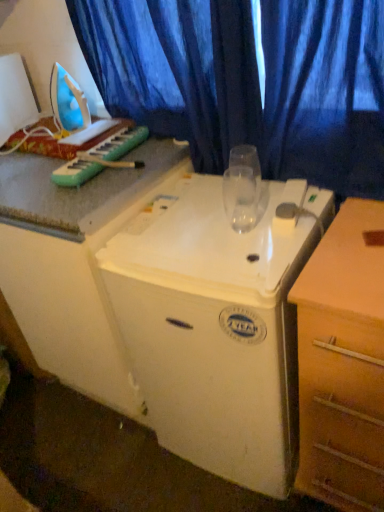
Question: Is white plastic iron at left, the first appliance positioned from the left, facing towards transparent glass at center?

Choices:
 (A) no
 (B) yes

Answer: (A)

Question: Considering the relative positions of white plastic iron at left, which appears as the 1th appliance when viewed from the top, and transparent glass at center in the image provided, is white plastic iron at left, which appears as the 1th appliance when viewed from the top, to the left of transparent glass at center from the viewer's perspective?

Choices:
 (A) no
 (B) yes

Answer: (B)

Question: Would you say white plastic iron at left, the first appliance positioned from the left, contains transparent glass at center?

Choices:
 (A) yes
 (B) no

Answer: (B)

Question: Would you consider white plastic iron at left, which is the second appliance in right-to-left order, to be distant from transparent glass at center?

Choices:
 (A) no
 (B) yes

Answer: (A)

Question: From the image's perspective, is white plastic iron at left, which appears as the 1th appliance when viewed from the top, above transparent glass at center?

Choices:
 (A) no
 (B) yes

Answer: (B)

Question: Looking at their shapes, would you say white plastic refrigerator at center, the second appliance in the left-to-right sequence, is wider or thinner than green plastic musical keyboard at upper left?

Choices:
 (A) thin
 (B) wide

Answer: (B)

Question: Is white plastic refrigerator at center, the 2th appliance from the top, bigger or smaller than green plastic musical keyboard at upper left?

Choices:
 (A) small
 (B) big

Answer: (B)

Question: From the image's perspective, is white plastic refrigerator at center, the first appliance in the right-to-left sequence, positioned above or below green plastic musical keyboard at upper left?

Choices:
 (A) above
 (B) below

Answer: (B)

Question: Would you say white plastic refrigerator at center, the 2th appliance from the top, is to the left or to the right of green plastic musical keyboard at upper left in the picture?

Choices:
 (A) right
 (B) left

Answer: (A)

Question: Looking at their shapes, would you say white plastic iron at left, which is the second appliance in right-to-left order, is wider or thinner than blue fabric curtain at upper center?

Choices:
 (A) thin
 (B) wide

Answer: (B)

Question: From a real-world perspective, is white plastic iron at left, acting as the second appliance starting from the bottom, physically located above or below blue fabric curtain at upper center?

Choices:
 (A) below
 (B) above

Answer: (B)

Question: Considering the positions of point [31, 101] and point [278, 157], is point [31, 101] closer or farther from the camera than point [278, 157]?

Choices:
 (A) closer
 (B) farther

Answer: (B)

Question: Is white plastic iron at left, acting as the second appliance starting from the bottom, to the left or to the right of blue fabric curtain at upper center in the image?

Choices:
 (A) left
 (B) right

Answer: (A)

Question: In terms of width, does wooden chest of drawers at right look wider or thinner when compared to white plastic refrigerator at center, the second appliance in the left-to-right sequence?

Choices:
 (A) thin
 (B) wide

Answer: (A)

Question: Is point (370, 497) positioned closer to the camera than point (243, 268)?

Choices:
 (A) farther
 (B) closer

Answer: (A)